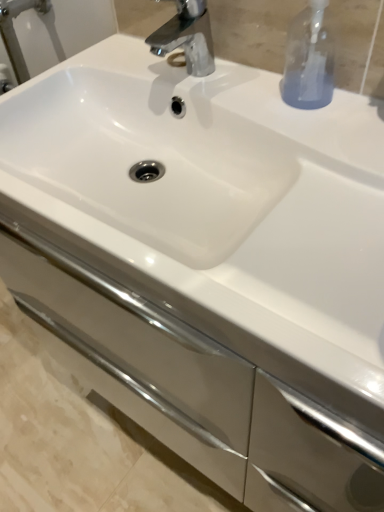
The height and width of the screenshot is (512, 384). What are the coordinates of `empty space that is in between transparent glass soap dispenser at upper right and polished chrome faucet at upper center` in the screenshot? It's located at (239, 93).